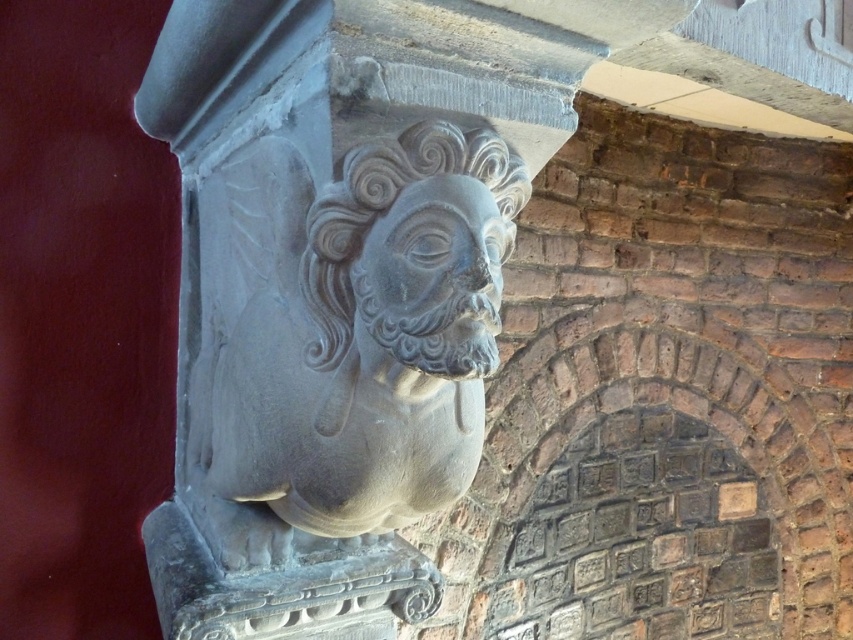
Question: Considering the real-world distances, which object is farthest from the gray stone face at center?

Choices:
 (A) gray stone bust at center
 (B) gray stone head at center

Answer: (B)

Question: Where is gray stone head at center located in relation to gray stone face at center in the image?

Choices:
 (A) left
 (B) right

Answer: (A)

Question: Which point is closer to the camera?

Choices:
 (A) gray stone head at center
 (B) gray stone face at center

Answer: (A)

Question: Can you confirm if gray stone head at center is bigger than gray stone face at center?

Choices:
 (A) no
 (B) yes

Answer: (B)

Question: Is gray stone bust at center thinner than gray stone face at center?

Choices:
 (A) yes
 (B) no

Answer: (B)

Question: Which point appears closest to the camera in this image?

Choices:
 (A) (459, 257)
 (B) (412, 326)

Answer: (B)